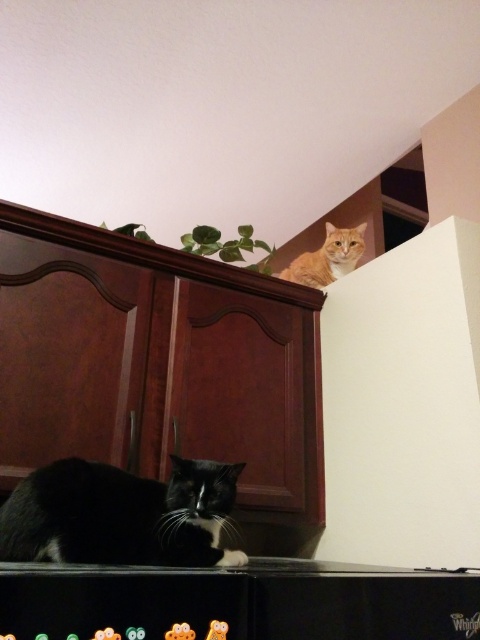
Question: Which point is farther to the camera?

Choices:
 (A) brown wood dresser at center
 (B) orange fur cat at upper right

Answer: (B)

Question: Which point is closer to the camera taking this photo?

Choices:
 (A) (309, 259)
 (B) (3, 556)

Answer: (B)

Question: Which of the following is the farthest from the observer?

Choices:
 (A) black fur cat at lower left
 (B) brown wood dresser at center

Answer: (B)

Question: Is brown wood dresser at center to the left of orange fur cat at upper right from the viewer's perspective?

Choices:
 (A) no
 (B) yes

Answer: (B)

Question: Is black fur cat at lower left thinner than orange fur cat at upper right?

Choices:
 (A) no
 (B) yes

Answer: (A)

Question: Is black fur cat at lower left thinner than orange fur cat at upper right?

Choices:
 (A) yes
 (B) no

Answer: (B)